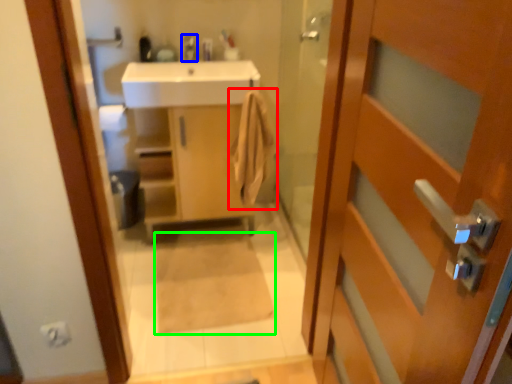
Question: Based on their relative distances, which object is nearer to bath towel (highlighted by a red box)? Choose from tap (highlighted by a blue box) and bath mat (highlighted by a green box).

Choices:
 (A) tap
 (B) bath mat

Answer: (B)